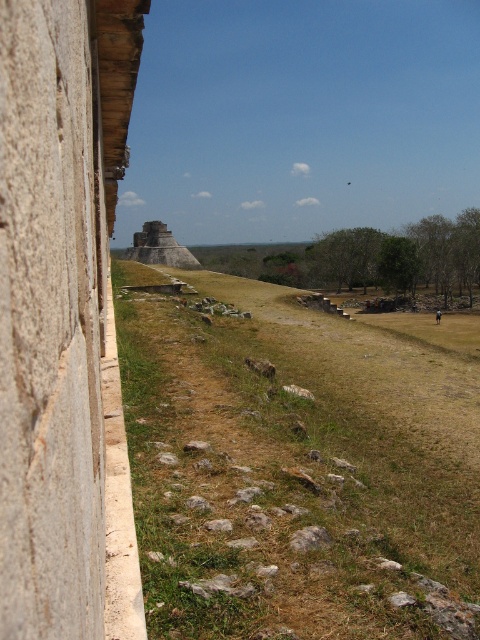
Question: Among these objects, which one is farthest from the camera?

Choices:
 (A) green grassy at center
 (B) light brown stone pyramid at center
 (C) smooth stone hut at left

Answer: (B)

Question: Which point is closer to the camera taking this photo?

Choices:
 (A) (166, 417)
 (B) (68, 182)
 (C) (151, 256)

Answer: (B)

Question: Does smooth stone hut at left have a larger size compared to light brown stone pyramid at center?

Choices:
 (A) yes
 (B) no

Answer: (B)

Question: Does smooth stone hut at left appear on the left side of light brown stone pyramid at center?

Choices:
 (A) no
 (B) yes

Answer: (A)

Question: Is smooth stone hut at left positioned at the back of light brown stone pyramid at center?

Choices:
 (A) yes
 (B) no

Answer: (B)

Question: Which of the following is the farthest from the observer?

Choices:
 (A) (141, 260)
 (B) (230, 365)
 (C) (91, 492)

Answer: (A)